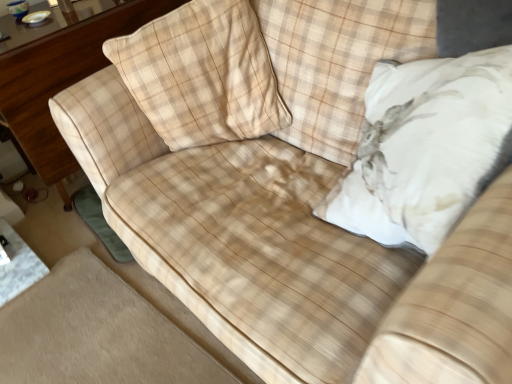
Measure the distance between point (78, 32) and camera.

5.31 feet.

Locate an element on the screen. The height and width of the screenshot is (384, 512). beige plaid pillow at upper left, the first throw pillow in the left-to-right sequence is located at coordinates (202, 74).

In the scene shown: Which object is positioned more to the left, beige plaid pillow at upper left, marked as the 2th throw pillow in a right-to-left arrangement, or white plush pillow at upper right, which is the second throw pillow in left-to-right order?

beige plaid pillow at upper left, marked as the 2th throw pillow in a right-to-left arrangement, is more to the left.

Is point (141, 40) behind point (466, 118)?

Yes.

How many degrees apart are the facing directions of beige plaid pillow at upper left, marked as the 2th throw pillow in a right-to-left arrangement, and white plush pillow at upper right, which is the second throw pillow in left-to-right order?

They differ by 52.4 degrees in their facing directions.

Is beige plaid pillow at upper left, marked as the 2th throw pillow in a right-to-left arrangement, shorter than white plush pillow at upper right, which is the second throw pillow in left-to-right order?

Correct, beige plaid pillow at upper left, marked as the 2th throw pillow in a right-to-left arrangement, is not as tall as white plush pillow at upper right, which is the second throw pillow in left-to-right order.

Does white plush pillow at upper right, which is the second throw pillow in left-to-right order, have a greater height compared to beige plaid pillow at upper left, the first throw pillow in the left-to-right sequence?

Correct, white plush pillow at upper right, which is the second throw pillow in left-to-right order, is much taller as beige plaid pillow at upper left, the first throw pillow in the left-to-right sequence.

Is white plush pillow at upper right, which is the second throw pillow in left-to-right order, to the left of beige plaid pillow at upper left, the first throw pillow in the left-to-right sequence, from the viewer's perspective?

Incorrect, white plush pillow at upper right, which is the second throw pillow in left-to-right order, is not on the left side of beige plaid pillow at upper left, the first throw pillow in the left-to-right sequence.

Is white plush pillow at upper right, which is the second throw pillow in left-to-right order, oriented away from beige plaid pillow at upper left, marked as the 2th throw pillow in a right-to-left arrangement?

white plush pillow at upper right, which is the second throw pillow in left-to-right order, is not turned away from beige plaid pillow at upper left, marked as the 2th throw pillow in a right-to-left arrangement.

Consider the image. Considering the relative sizes of white plush pillow at upper right, marked as the 1th throw pillow in a right-to-left arrangement, and beige plaid pillow at upper left, the first throw pillow in the left-to-right sequence, in the image provided, is white plush pillow at upper right, marked as the 1th throw pillow in a right-to-left arrangement, thinner than beige plaid pillow at upper left, the first throw pillow in the left-to-right sequence,?

No, white plush pillow at upper right, marked as the 1th throw pillow in a right-to-left arrangement, is not thinner than beige plaid pillow at upper left, the first throw pillow in the left-to-right sequence.

Is wooden dresser at left at the left side of beige plaid pillow at upper left, the first throw pillow in the left-to-right sequence?

Yes.

Is wooden dresser at left positioned with its back to beige plaid pillow at upper left, marked as the 2th throw pillow in a right-to-left arrangement?

No, wooden dresser at left is not facing the opposite direction of beige plaid pillow at upper left, marked as the 2th throw pillow in a right-to-left arrangement.

Is beige plaid pillow at upper left, the first throw pillow in the left-to-right sequence, inside wooden dresser at left?

No, beige plaid pillow at upper left, the first throw pillow in the left-to-right sequence, is not a part of wooden dresser at left.

Who is bigger, wooden dresser at left or beige plaid pillow at upper left, the first throw pillow in the left-to-right sequence?

wooden dresser at left.

In terms of height, does beige plaid pillow at upper left, marked as the 2th throw pillow in a right-to-left arrangement, look taller or shorter compared to wooden dresser at left?

beige plaid pillow at upper left, marked as the 2th throw pillow in a right-to-left arrangement, is shorter than wooden dresser at left.

From a real-world perspective, does beige plaid pillow at upper left, marked as the 2th throw pillow in a right-to-left arrangement, sit lower than wooden dresser at left?

Actually, beige plaid pillow at upper left, marked as the 2th throw pillow in a right-to-left arrangement, is physically above wooden dresser at left in the real world.

Can you confirm if beige plaid pillow at upper left, marked as the 2th throw pillow in a right-to-left arrangement, is positioned to the right of wooden dresser at left?

Correct, you'll find beige plaid pillow at upper left, marked as the 2th throw pillow in a right-to-left arrangement, to the right of wooden dresser at left.

Which of these two, beige plaid pillow at upper left, the first throw pillow in the left-to-right sequence, or wooden dresser at left, is wider?

Wider between the two is wooden dresser at left.

Considering the positions of point (139, 2) and point (391, 189), is point (139, 2) closer or farther from the camera than point (391, 189)?

Point (139, 2) is farther from the camera than point (391, 189).

Does wooden dresser at left come behind white plush pillow at upper right, marked as the 1th throw pillow in a right-to-left arrangement?

Yes, wooden dresser at left is behind white plush pillow at upper right, marked as the 1th throw pillow in a right-to-left arrangement.

From a real-world perspective, between wooden dresser at left and white plush pillow at upper right, which is the second throw pillow in left-to-right order, who is vertically higher?

white plush pillow at upper right, which is the second throw pillow in left-to-right order, is physically above.

This screenshot has width=512, height=384. What are the coordinates of `throw pillow that is the 2nd one when counting forward from the wooden dresser at left` in the screenshot? It's located at (426, 148).

Consider the image. From the image's perspective, between white plush pillow at upper right, which is the second throw pillow in left-to-right order, and wooden dresser at left, who is located below?

white plush pillow at upper right, which is the second throw pillow in left-to-right order, appears lower in the image.

Would you say white plush pillow at upper right, marked as the 1th throw pillow in a right-to-left arrangement, contains wooden dresser at left?

Actually, wooden dresser at left is outside white plush pillow at upper right, marked as the 1th throw pillow in a right-to-left arrangement.

Is white plush pillow at upper right, marked as the 1th throw pillow in a right-to-left arrangement, facing away from wooden dresser at left?

No, white plush pillow at upper right, marked as the 1th throw pillow in a right-to-left arrangement,'s orientation is not away from wooden dresser at left.

Is point (357, 176) more distant than point (28, 117)?

No, it is in front of (28, 117).

You are a GUI agent. You are given a task and a screenshot of the screen. Output one action in this format:
    pyautogui.click(x=<x>, y=<y>)
    Task: Click on the throw pillow below the beige plaid pillow at upper left, the first throw pillow in the left-to-right sequence (from the image's perspective)
    This screenshot has height=384, width=512.
    Given the screenshot: What is the action you would take?
    pyautogui.click(x=426, y=148)

Locate an element on the screen. The image size is (512, 384). throw pillow in front of the beige plaid pillow at upper left, marked as the 2th throw pillow in a right-to-left arrangement is located at coordinates click(x=426, y=148).

Based on their spatial positions, is beige plaid pillow at upper left, the first throw pillow in the left-to-right sequence, or white plush pillow at upper right, which is the second throw pillow in left-to-right order, closer to wooden dresser at left?

beige plaid pillow at upper left, the first throw pillow in the left-to-right sequence, lies closer to wooden dresser at left than the other object.

When comparing their distances from beige plaid pillow at upper left, the first throw pillow in the left-to-right sequence, does white plush pillow at upper right, marked as the 1th throw pillow in a right-to-left arrangement, or wooden dresser at left seem further?

Among the two, wooden dresser at left is located further to beige plaid pillow at upper left, the first throw pillow in the left-to-right sequence.

From the picture: From the image, which object appears to be farther from wooden dresser at left, white plush pillow at upper right, marked as the 1th throw pillow in a right-to-left arrangement, or beige plaid pillow at upper left, marked as the 2th throw pillow in a right-to-left arrangement?

white plush pillow at upper right, marked as the 1th throw pillow in a right-to-left arrangement, lies further to wooden dresser at left than the other object.

Looking at the image, which one is located closer to white plush pillow at upper right, marked as the 1th throw pillow in a right-to-left arrangement, wooden dresser at left or beige plaid pillow at upper left, the first throw pillow in the left-to-right sequence?

Based on the image, beige plaid pillow at upper left, the first throw pillow in the left-to-right sequence, appears to be nearer to white plush pillow at upper right, marked as the 1th throw pillow in a right-to-left arrangement.

Which object lies nearer to the anchor point white plush pillow at upper right, which is the second throw pillow in left-to-right order, beige plaid pillow at upper left, the first throw pillow in the left-to-right sequence, or wooden dresser at left?

beige plaid pillow at upper left, the first throw pillow in the left-to-right sequence, is positioned closer to the anchor white plush pillow at upper right, which is the second throw pillow in left-to-right order.

When comparing their distances from beige plaid pillow at upper left, the first throw pillow in the left-to-right sequence, does wooden dresser at left or white plush pillow at upper right, marked as the 1th throw pillow in a right-to-left arrangement, seem further?

wooden dresser at left.

This screenshot has height=384, width=512. I want to click on throw pillow between wooden dresser at left and white plush pillow at upper right, which is the second throw pillow in left-to-right order, from left to right, so click(202, 74).